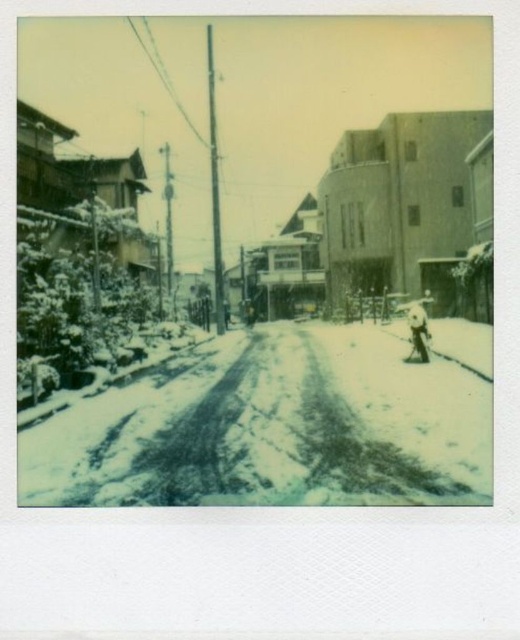
Question: Does white snow at center have a smaller size compared to white powdery snow at center?

Choices:
 (A) yes
 (B) no

Answer: (B)

Question: Among these points, which one is farthest from the camera?

Choices:
 (A) (459, 500)
 (B) (118, 68)

Answer: (B)

Question: Does white snow at center have a greater width compared to white powdery snow at center?

Choices:
 (A) no
 (B) yes

Answer: (B)

Question: Which of the following is the closest to the observer?

Choices:
 (A) white snow at center
 (B) white powdery snow at center

Answer: (B)

Question: Is white snow at center thinner than white powdery snow at center?

Choices:
 (A) yes
 (B) no

Answer: (B)